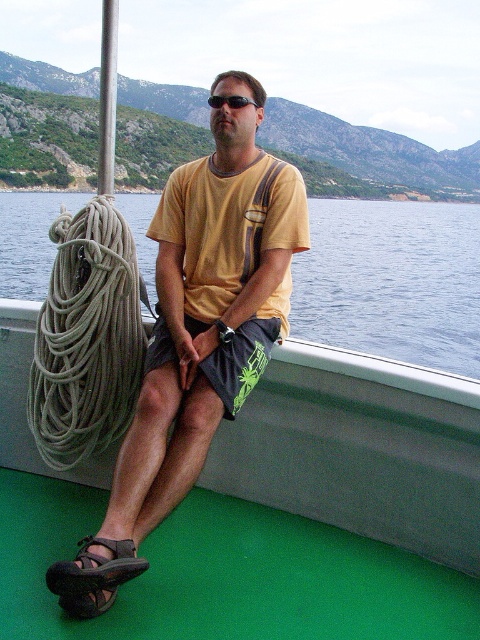
You are standing on the deck of the boat and want to look at the blue water at center. Which direction should you turn to see it from the brown leather sandal at lower left?

The blue water at center is positioned on the left side of brown leather sandal at lower left, so you should turn to your left to see it from the brown leather sandal at lower left.

You are a photographer standing on the deck of the boat. You notice the gray fabric rope at left and the brown leather sandal at lower left. Which object is positioned higher from the deck floor?

The gray fabric rope at left is located above the brown leather sandal at lower left, so it is positioned higher from the deck floor.